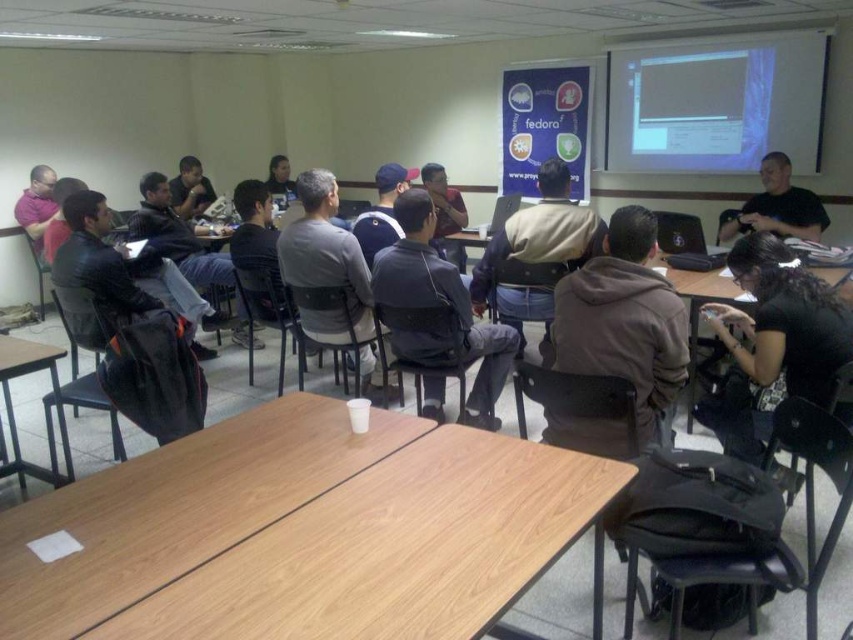
You are standing in the classroom and want to reach both the point at coordinate (x=752, y=372) and the point at coordinate (x=454, y=193). Which point should you reach first to minimize the distance you walk?

You should reach the point at coordinate (x=752, y=372) first because it is closer to you than the point at coordinate (x=454, y=193).

You are organizing a classroom and need to place a new poster that is 1 meter wide. The poster must be placed on the wooden table at center or the matte black shirt at upper center. Which object can accommodate the poster without it hanging over the edge?

The wooden table at center has a larger width than the matte black shirt at upper center, so the poster can be placed on the wooden table at center without hanging over the edge.

You are organizing a classroom and need to place a new item between the dark gray hoodie at center and the dark blue fabric jacket at center. The item is 12 inches long. Will there be enough space between them to fit the item?

The dark gray hoodie at center is 28.52 inches from the dark blue fabric jacket at center. Since the item is 12 inches long, there is sufficient space between them to fit the item.